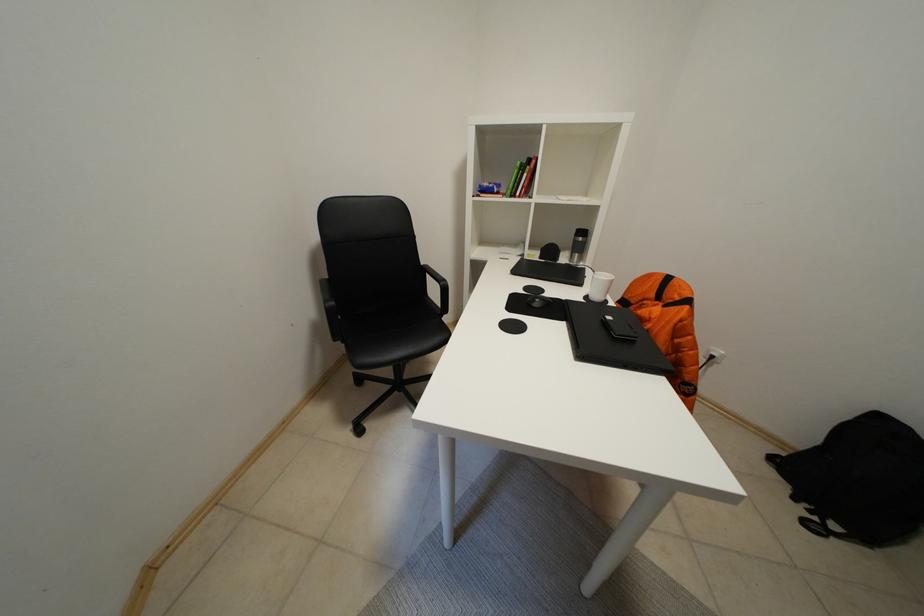
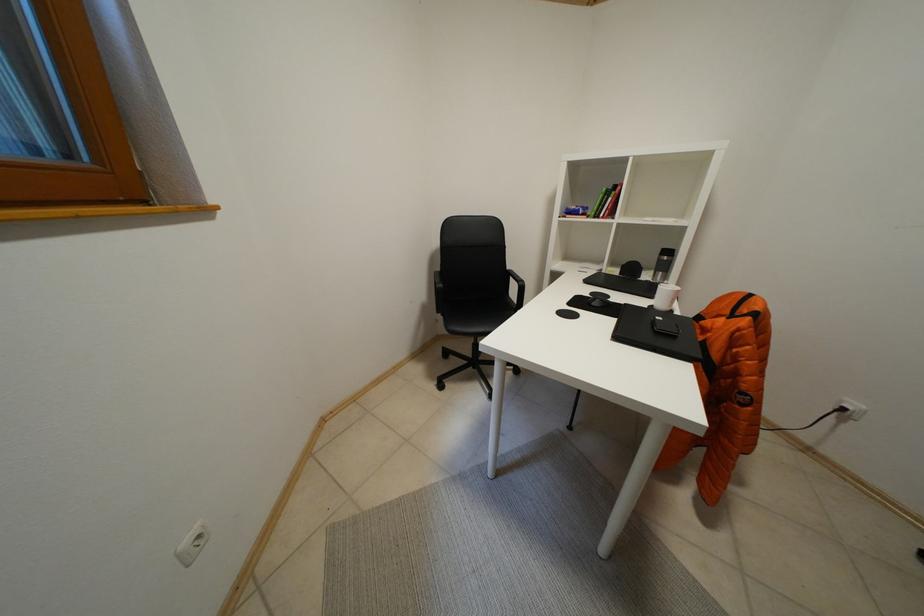
From the picture: Which direction would the cameraman need to move to produce the second image?

The movement direction of the cameraman is right, backward.